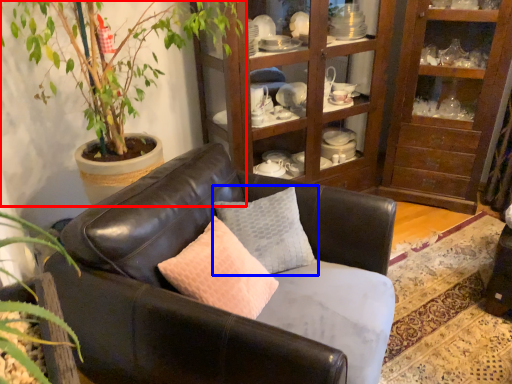
Question: Which object is further to the camera taking this photo, houseplant (highlighted by a red box) or pillow (highlighted by a blue box)?

Choices:
 (A) houseplant
 (B) pillow

Answer: (B)